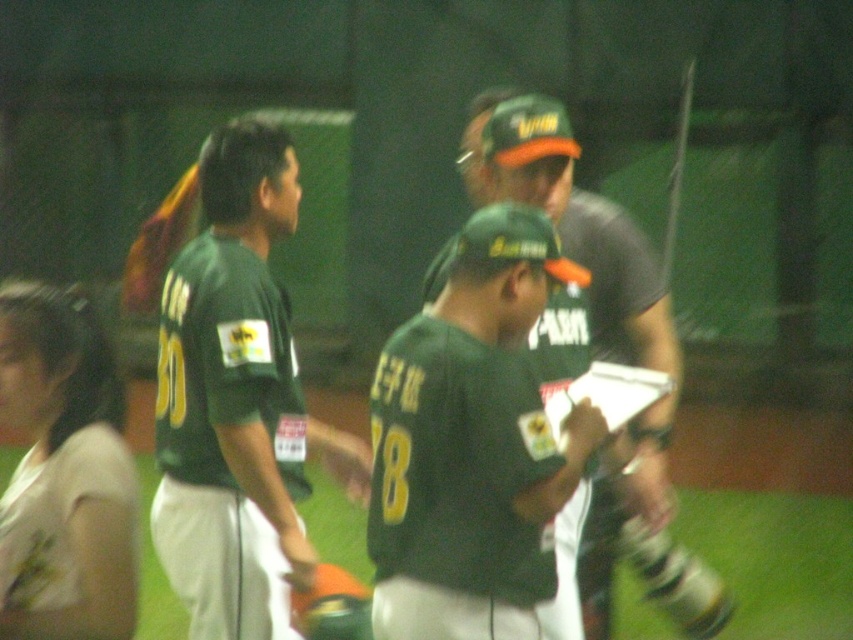
Please provide the coordinates of the green matte jersey at center in the image.

The coordinates of the green matte jersey at center are at point (223, 438).

You are a photographer at the baseball game and need to capture a clear shot of both the matte green jersey at center and the matte green cap at center. Which object should you focus on first if you want to ensure the taller object is in focus?

The matte green jersey at center is not as tall as the matte green cap at center, so you should focus on the matte green cap at center first since it is taller.

You are a photographer at the baseball game and want to capture a clear shot of both the green matte jersey at center and the matte green cap at center. Since the lighting is uneven, you need to adjust your camera settings. Which object should you focus on first to ensure it is in the foreground for better visibility?

The green matte jersey at center is located below the matte green cap at center. Since the jersey is lower, you should focus on the matte green cap at center first as it is higher and might be in the foreground if the cap is closer to the camera.